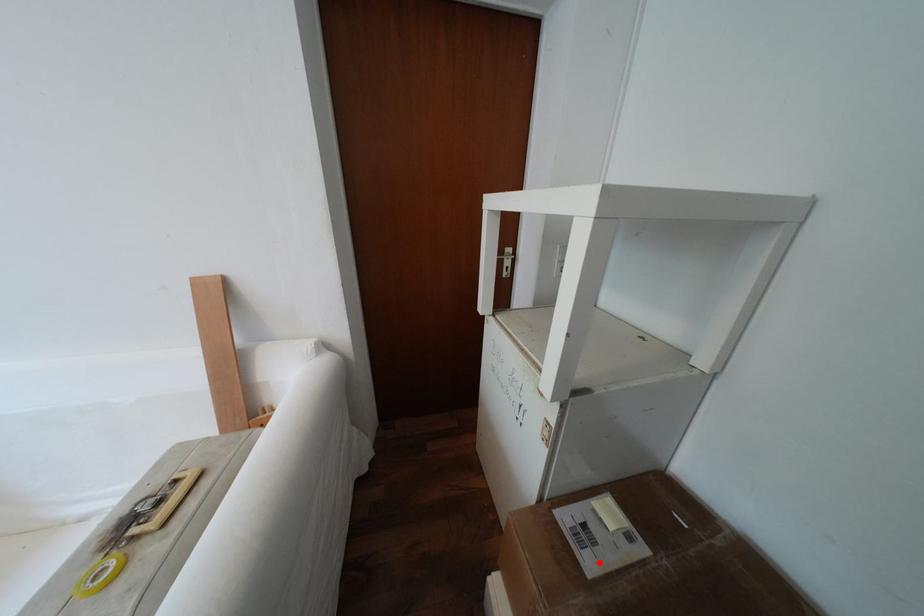
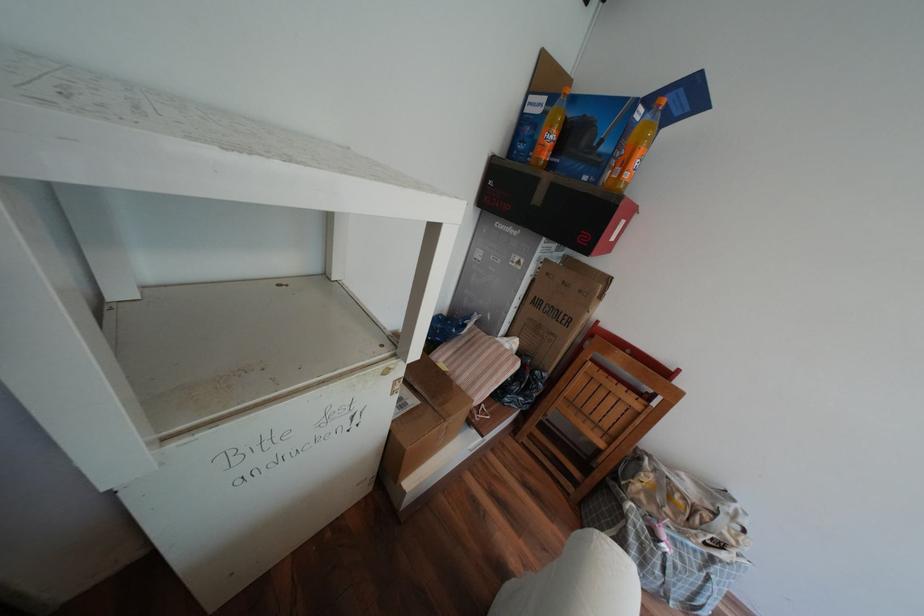
Question: A red point is marked in image1. In image2, is the corresponding 3D point closer to the camera or farther? Reply with the corresponding letter.

Choices:
 (A) The corresponding 3D point is closer.
 (B) The corresponding 3D point is farther.

Answer: (B)